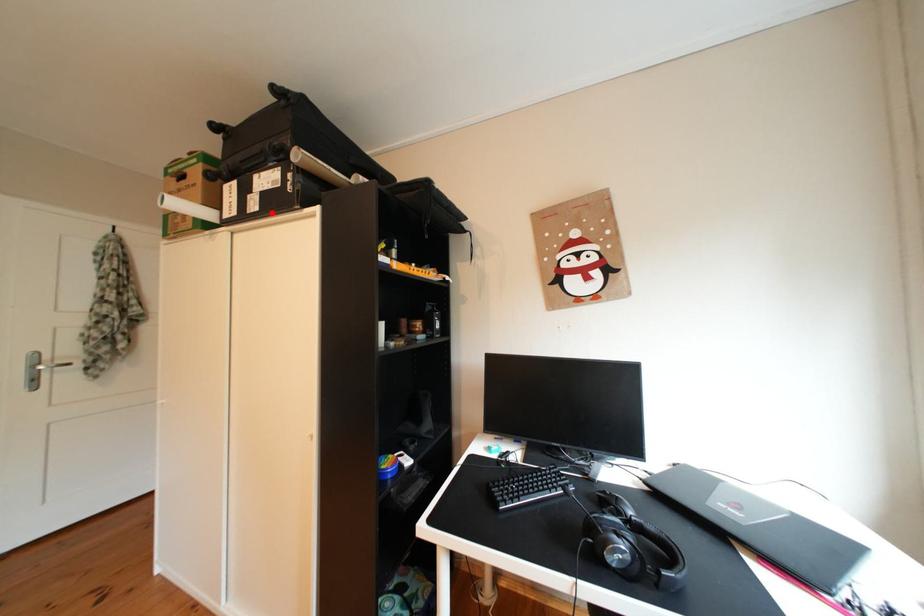
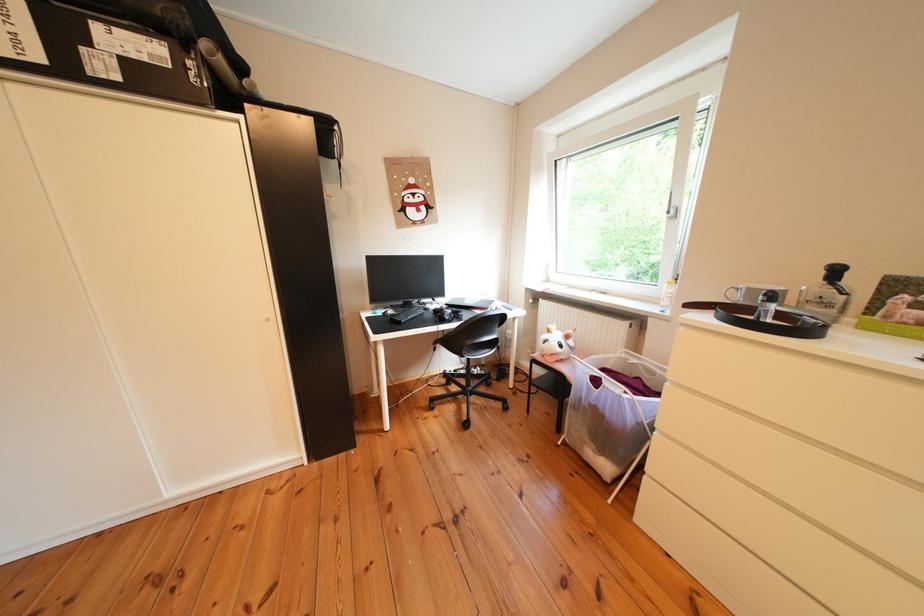
Locate, in the second image, the point that corresponds to the highlighted location in the first image.

(131, 83)